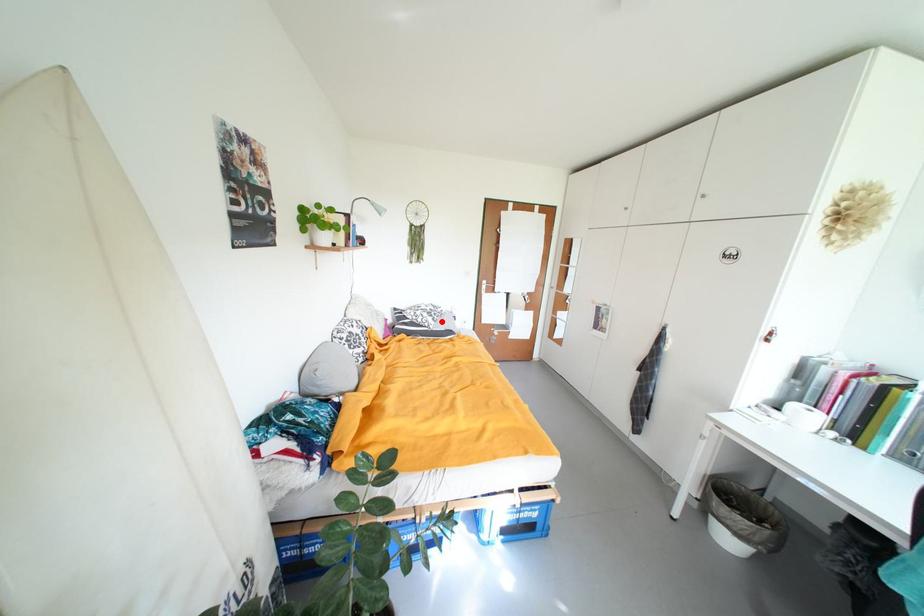
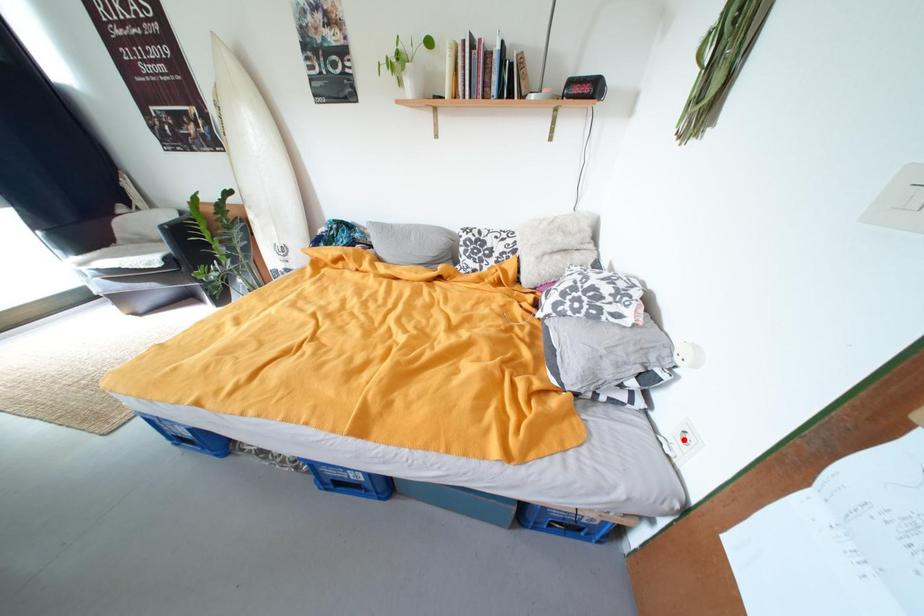
I am providing you with two images of the same scene from different viewpoints. A red point is marked on the first image and another point is marked on the second image. Do the highlighted points in image1 and image2 indicate the same real-world spot?

No